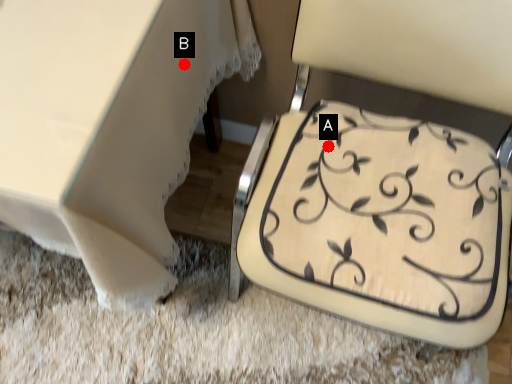
Question: Two points are circled on the image, labeled by A and B beside each circle. Which point is closer to the camera?

Choices:
 (A) A is closer
 (B) B is closer

Answer: (B)